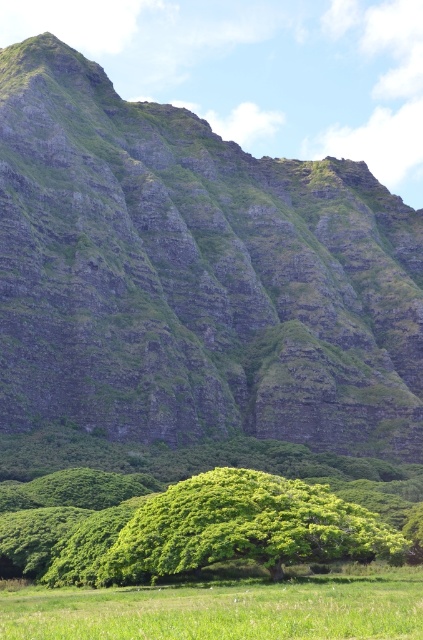
Can you confirm if green grassy mountain at upper center is thinner than green leafy tree at center?

In fact, green grassy mountain at upper center might be wider than green leafy tree at center.

Is point (29, 116) farther from viewer compared to point (286, 547)?

Yes, point (29, 116) is behind point (286, 547).

Is point (137, 224) behind point (162, 493)?

Yes, it is.

Where is `green grassy mountain at upper center`? The image size is (423, 640). green grassy mountain at upper center is located at coordinates (195, 275).

Does green grass at lower center appear on the left side of green leafy tree at center?

Correct, you'll find green grass at lower center to the left of green leafy tree at center.

Who is positioned more to the right, green grass at lower center or green leafy tree at center?

From the viewer's perspective, green leafy tree at center appears more on the right side.

This screenshot has width=423, height=640. Find the location of `green grass at lower center`. green grass at lower center is located at coordinates (224, 609).

Which is above, green grassy mountain at upper center or green grass at lower center?

green grassy mountain at upper center

Describe the element at coordinates (195, 275) in the screenshot. I see `green grassy mountain at upper center` at that location.

Describe the element at coordinates (195, 275) in the screenshot. The image size is (423, 640). I see `green grassy mountain at upper center` at that location.

At what (x,y) coordinates should I click in order to perform the action: click on green grassy mountain at upper center. Please return your answer as a coordinate pair (x, y). Image resolution: width=423 pixels, height=640 pixels. Looking at the image, I should click on (195, 275).